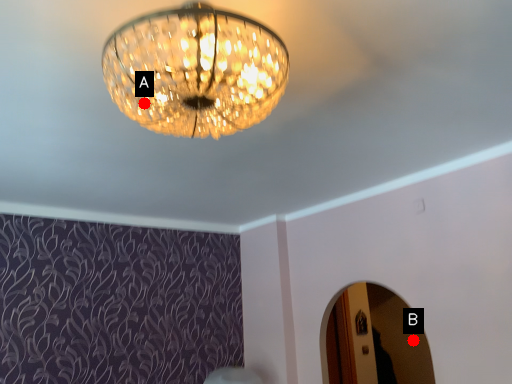
Question: Two points are circled on the image, labeled by A and B beside each circle. Which point appears closest to the camera in this image?

Choices:
 (A) A is closer
 (B) B is closer

Answer: (A)